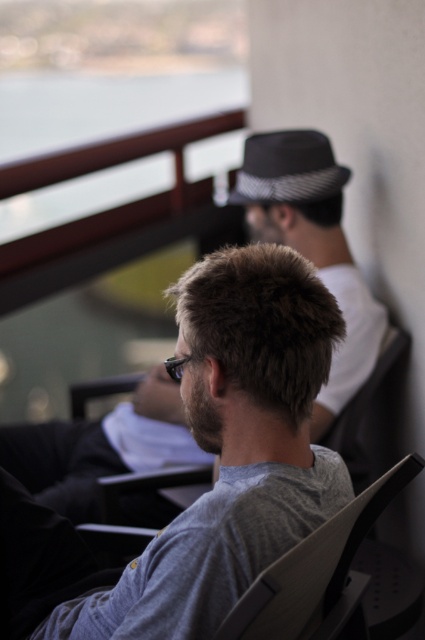
Is gray matte shirt at center smaller than gray woolen hat at upper right?

Yes.

Can you confirm if gray matte shirt at center is shorter than gray woolen hat at upper right?

Indeed, gray matte shirt at center has a lesser height compared to gray woolen hat at upper right.

I want to click on gray matte shirt at center, so click(232, 449).

Locate an element on the screen. gray matte shirt at center is located at coordinates (232, 449).

Does gray woolen hat at upper right have a lesser width compared to gray matte sunglasses at center?

Indeed, gray woolen hat at upper right has a lesser width compared to gray matte sunglasses at center.

Identify the location of gray woolen hat at upper right. The height and width of the screenshot is (640, 425). (312, 244).

Which is more to the left, gray matte shirt at center or gray matte sunglasses at center?

Positioned to the left is gray matte sunglasses at center.

Is the position of gray matte shirt at center less distant than that of gray matte sunglasses at center?

Yes, gray matte shirt at center is closer to the viewer.

The width and height of the screenshot is (425, 640). Identify the location of gray matte shirt at center. pos(232,449).